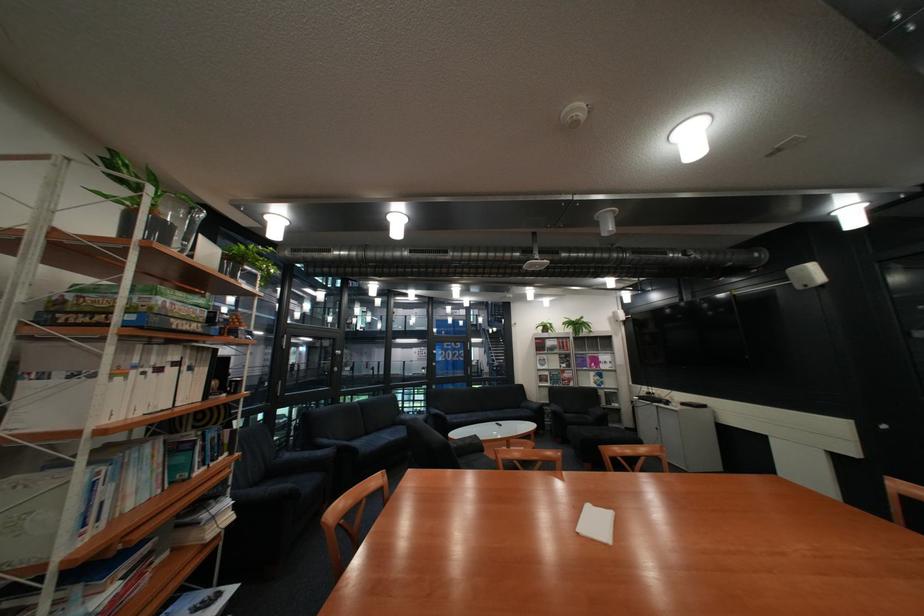
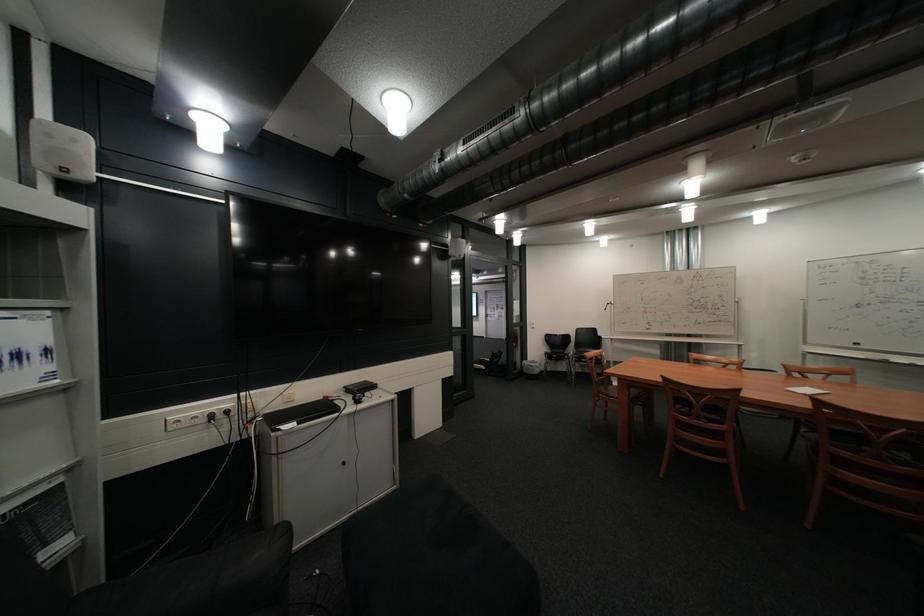
Locate, in the second image, the point that corresponds to point (621, 391) in the first image.

(10, 514)